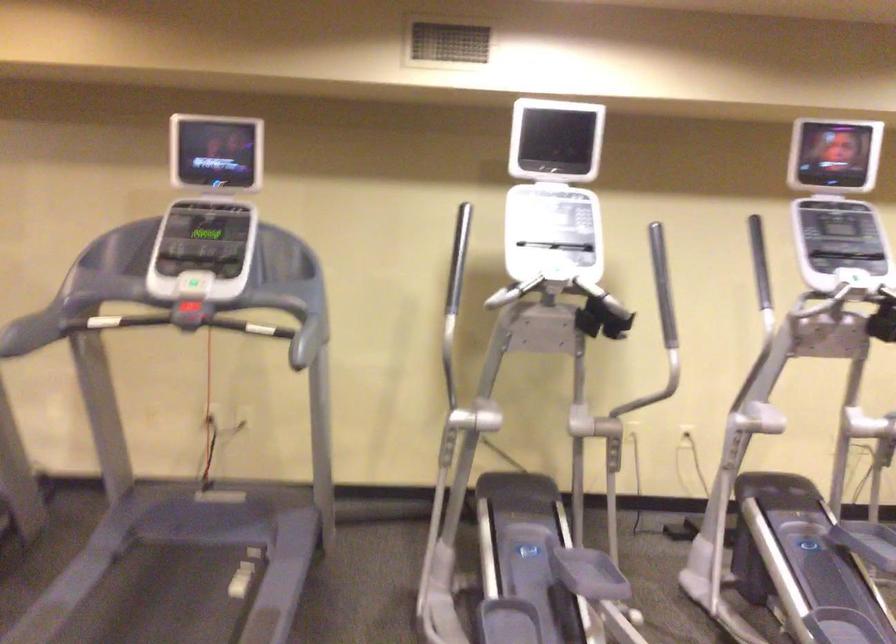
This screenshot has height=644, width=896. In order to click on elliptical foot pedal in this screenshot , I will do `click(857, 623)`.